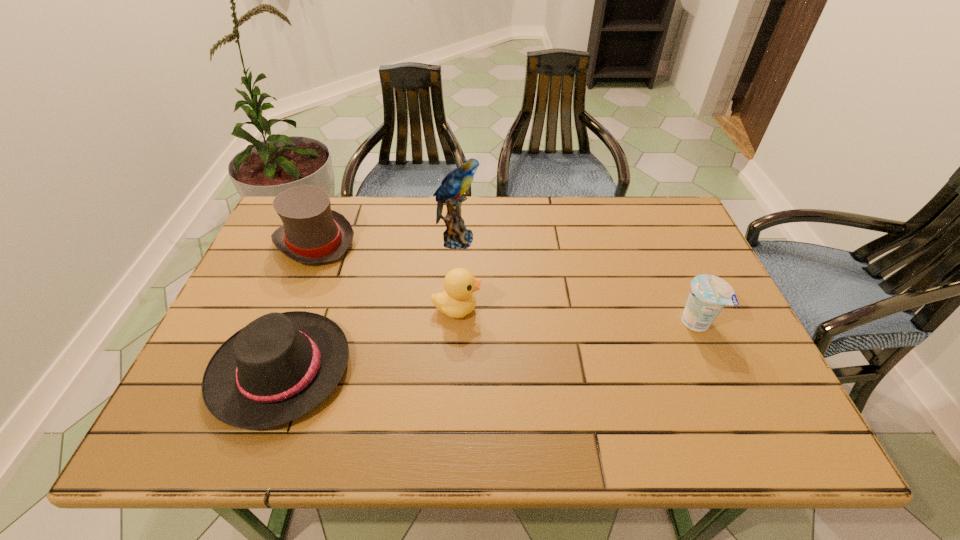
At what (x,y) coordinates should I click in order to perform the action: click on vacant space at the far right corner of the desktop. Please return your answer as a coordinate pair (x, y). This screenshot has width=960, height=540. Looking at the image, I should click on (634, 221).

Image resolution: width=960 pixels, height=540 pixels. In order to click on vacant space at the near right corner of the desktop in this screenshot , I will do `click(724, 416)`.

I want to click on free spot between the parrot and the nearer dress hat, so click(370, 305).

This screenshot has height=540, width=960. I want to click on empty space between the farther dress hat and the parrot, so click(386, 240).

Locate an element on the screen. free space between the rightmost object and the tallest object is located at coordinates (576, 281).

This screenshot has width=960, height=540. In order to click on free space between the duck and the yogurt in this screenshot , I will do `click(576, 316)`.

Where is `empty space between the farther dress hat and the yogurt`? empty space between the farther dress hat and the yogurt is located at coordinates (506, 282).

Locate an element on the screen. empty space between the tallest object and the shorter dress hat is located at coordinates (370, 305).

This screenshot has width=960, height=540. Identify the location of free space that is in between the parrot and the yogurt. (576, 281).

You are a GUI agent. You are given a task and a screenshot of the screen. Output one action in this format:
    pyautogui.click(x=<x>, y=<y>)
    Task: Click on the vacant space in between the tallest object and the taller dress hat
    The height and width of the screenshot is (540, 960).
    Given the screenshot: What is the action you would take?
    pyautogui.click(x=386, y=240)